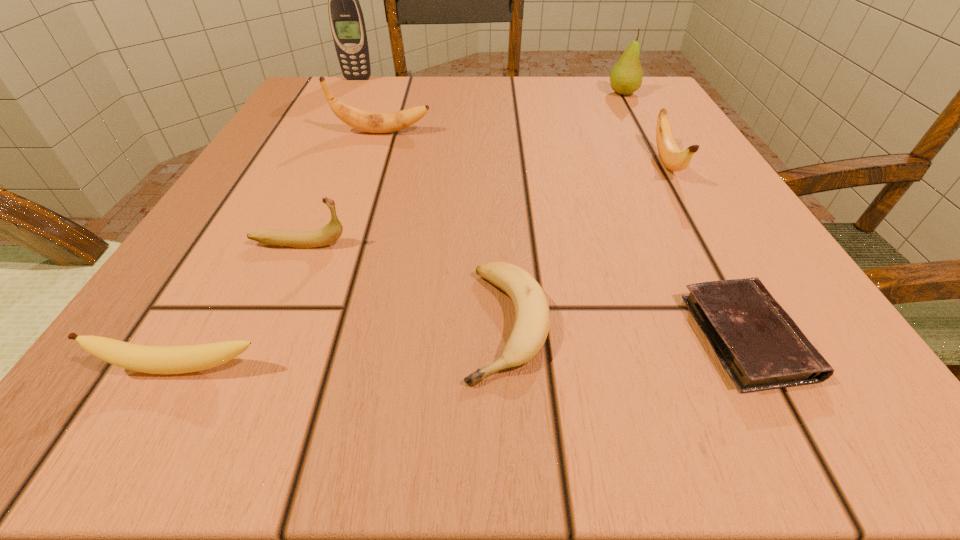
The height and width of the screenshot is (540, 960). Identify the location of object that can be found as the sixth closest to the second shortest banana. (347, 23).

Locate an element on the screen. The image size is (960, 540). banana that stands as the third closest to the fifth farthest object is located at coordinates (361, 120).

Choose which banana is the second nearest neighbor to the third nearest banana. Please provide its 2D coordinates. Your answer should be formatted as a tuple, i.e. [(x, y)], where the tuple contains the x and y coordinates of a point satisfying the conditions above.

[(189, 358)]

You are a GUI agent. You are given a task and a screenshot of the screen. Output one action in this format:
    pyautogui.click(x=<x>, y=<y>)
    Task: Click on the vacant area that satisfies the following two spatial constraints: 1. on the screen of the cellular telephone; 2. on the right side of the diary
    
    Given the screenshot: What is the action you would take?
    pyautogui.click(x=228, y=338)

Where is `free location that satisfies the following two spatial constraints: 1. on the peel of the farthest banana from the top; 2. on the right side of the second banana from right to left`? Image resolution: width=960 pixels, height=540 pixels. free location that satisfies the following two spatial constraints: 1. on the peel of the farthest banana from the top; 2. on the right side of the second banana from right to left is located at coordinates (319, 324).

This screenshot has width=960, height=540. I want to click on free space that satisfies the following two spatial constraints: 1. at the stem of the rightmost banana; 2. at the stem of the fourth nearest object, so click(x=711, y=244).

The image size is (960, 540). Identify the location of vacant space that satisfies the following two spatial constraints: 1. on the front side of the pear; 2. at the stem of the fourth nearest object. (707, 244).

In order to click on free spot that satisfies the following two spatial constraints: 1. at the stem of the seventh tallest object; 2. on the left side of the third farthest banana in this screenshot , I will do `click(264, 324)`.